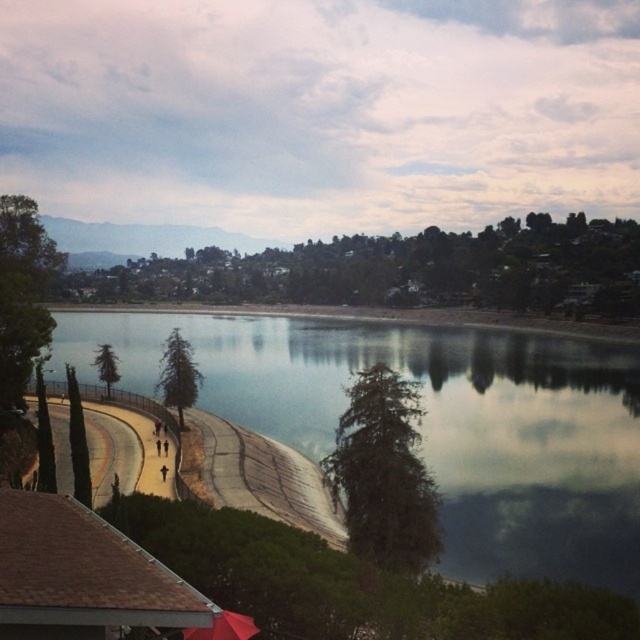
Question: Does clear water at center lie behind red matte umbrella at lower center?

Choices:
 (A) yes
 (B) no

Answer: (A)

Question: Does clear water at center lie behind red matte umbrella at lower center?

Choices:
 (A) yes
 (B) no

Answer: (A)

Question: Is the position of clear water at center more distant than that of red matte umbrella at lower center?

Choices:
 (A) yes
 (B) no

Answer: (A)

Question: Which object appears farthest from the camera in this image?

Choices:
 (A) clear water at center
 (B) red matte umbrella at lower center

Answer: (A)

Question: Which point is farther to the camera?

Choices:
 (A) red matte umbrella at lower center
 (B) clear water at center

Answer: (B)